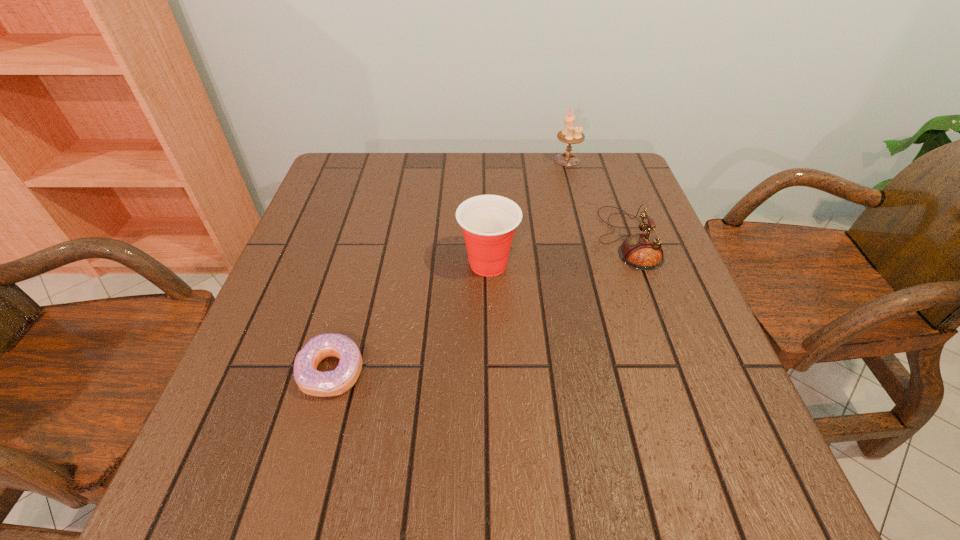
Image resolution: width=960 pixels, height=540 pixels. What are the coordinates of `the farthest object` in the screenshot? It's located at (570, 135).

I want to click on cup, so click(488, 222).

You are a GUI agent. You are given a task and a screenshot of the screen. Output one action in this format:
    pyautogui.click(x=<x>, y=<y>)
    Task: Click on the second shortest object
    This screenshot has height=540, width=960.
    Given the screenshot: What is the action you would take?
    pyautogui.click(x=643, y=251)

Identify the location of the nearest object. (310, 381).

Where is `doughnut`? This screenshot has width=960, height=540. doughnut is located at coordinates (310, 381).

Identify the location of blank space located on the front of the farthest object. (580, 205).

The image size is (960, 540). I want to click on vacant area situated 0.280m on the back of the third object from right to left, so click(x=487, y=179).

At what (x,y) coordinates should I click in order to perform the action: click on free spot located on the rotary dial of the telephone. Please return your answer as a coordinate pair (x, y). Looking at the image, I should click on (515, 239).

I want to click on free space located on the rotary dial of the telephone, so click(456, 239).

The height and width of the screenshot is (540, 960). In order to click on free space located 0.220m on the rotary dial of the telephone in this screenshot , I will do `click(506, 239)`.